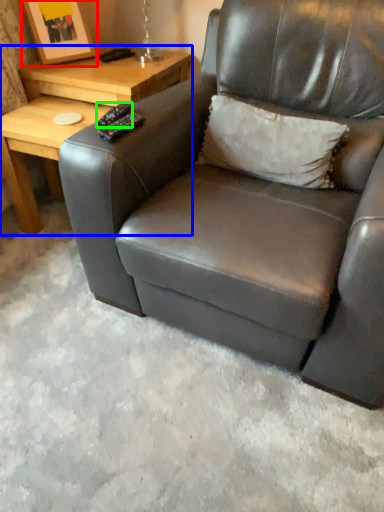
Question: Which object is the closest to the picture frame (highlighted by a red box)? Choose among these: table (highlighted by a blue box) or remote (highlighted by a green box).

Choices:
 (A) table
 (B) remote

Answer: (A)